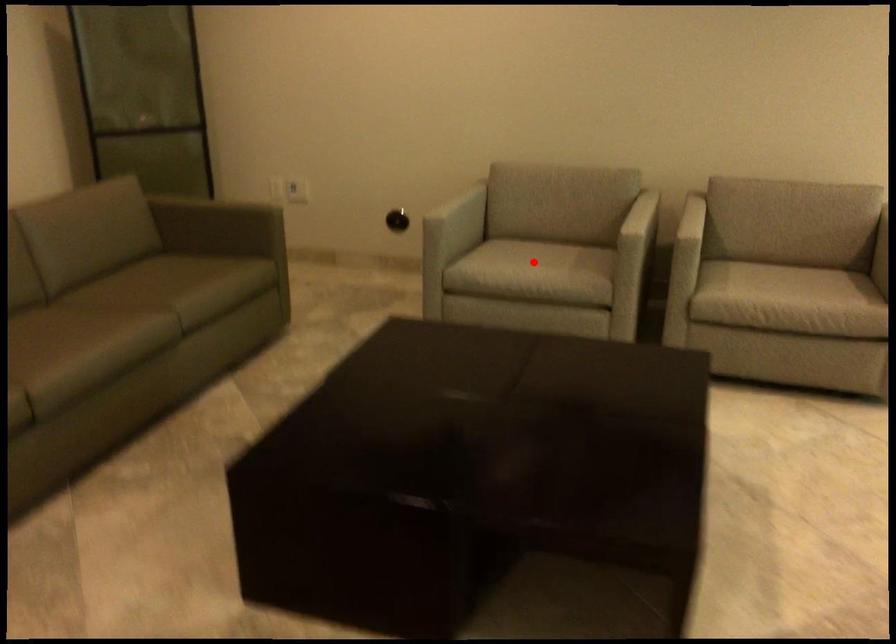
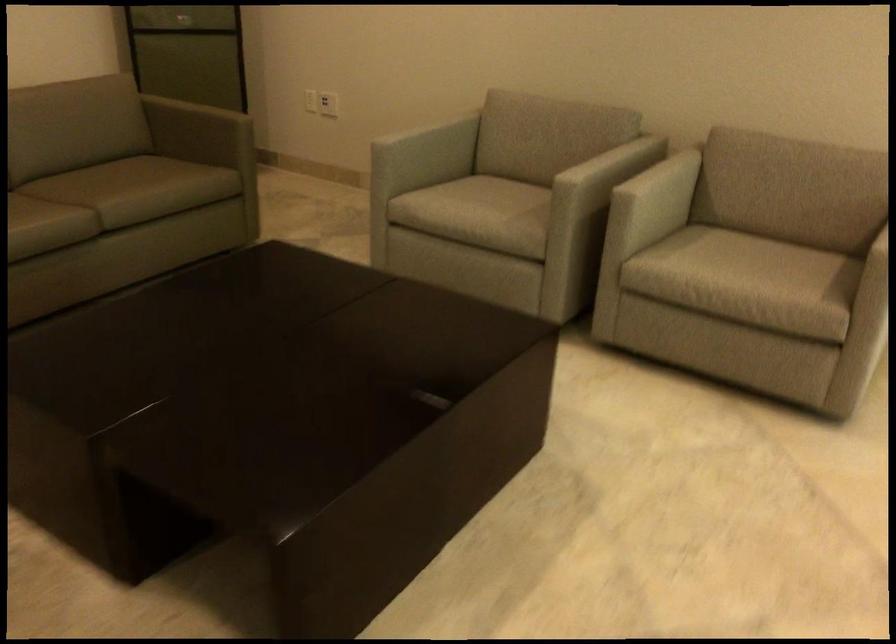
Locate, in the second image, the point that corresponds to the highlighted location in the first image.

(480, 207)